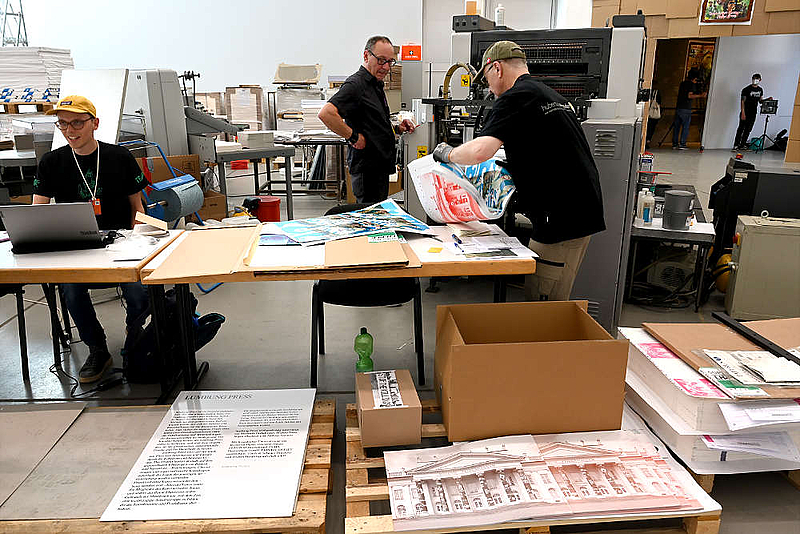
I want to click on art prints, so click(x=456, y=193), click(x=342, y=224).